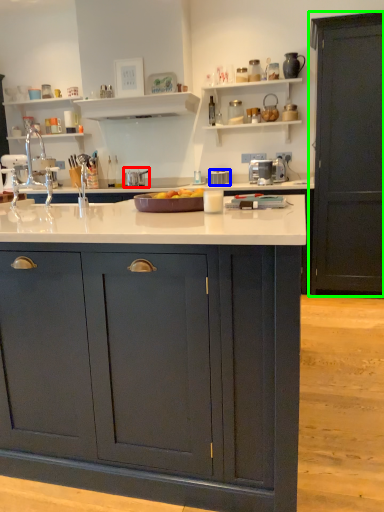
Question: Which is nearer to the appliance (highlighted by a red box)? appliance (highlighted by a blue box) or cabinetry (highlighted by a green box).

Choices:
 (A) appliance
 (B) cabinetry

Answer: (A)